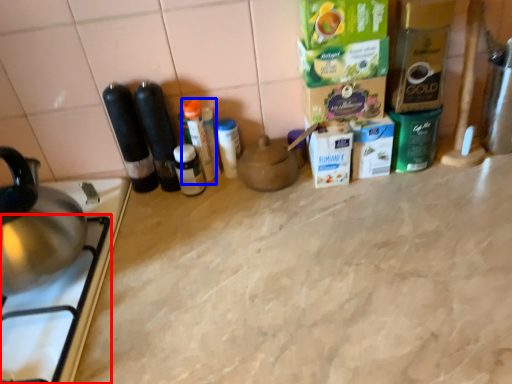
Question: Which object appears farthest to the camera in this image, gas stove (highlighted by a red box) or bottle (highlighted by a blue box)?

Choices:
 (A) gas stove
 (B) bottle

Answer: (B)